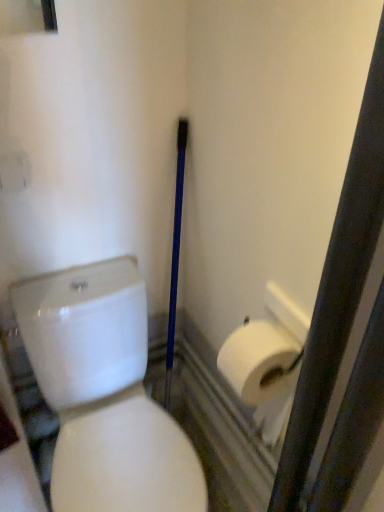
Question: In terms of height, does white matte toilet paper at right look taller or shorter compared to white glossy toilet at center?

Choices:
 (A) short
 (B) tall

Answer: (A)

Question: Visually, is white matte toilet paper at right positioned to the left or to the right of white glossy toilet at center?

Choices:
 (A) left
 (B) right

Answer: (B)

Question: In terms of size, does white matte toilet paper at right appear bigger or smaller than white glossy toilet at center?

Choices:
 (A) small
 (B) big

Answer: (A)

Question: Would you say white glossy toilet at center is inside or outside white matte toilet paper at right?

Choices:
 (A) outside
 (B) inside

Answer: (A)

Question: Considering the positions of white glossy toilet at center and white matte toilet paper at right in the image, is white glossy toilet at center taller or shorter than white matte toilet paper at right?

Choices:
 (A) tall
 (B) short

Answer: (A)

Question: From a real-world perspective, is white glossy toilet at center physically located above or below white matte toilet paper at right?

Choices:
 (A) above
 (B) below

Answer: (B)

Question: Considering the positions of point (84, 303) and point (288, 360), is point (84, 303) closer or farther from the camera than point (288, 360)?

Choices:
 (A) closer
 (B) farther

Answer: (B)